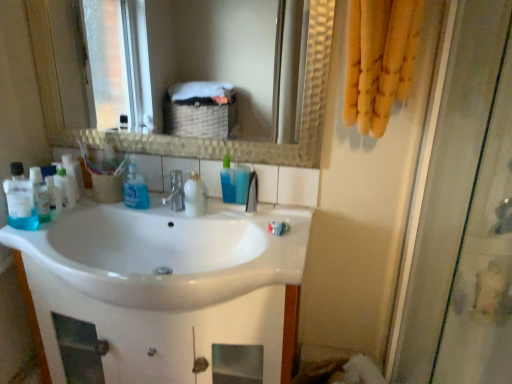
What is the approximate width of blue liquid soap at center, the 3th cleaning product from the right?

blue liquid soap at center, the 3th cleaning product from the right, is 3.65 inches wide.

You are a GUI agent. You are given a task and a screenshot of the screen. Output one action in this format:
    pyautogui.click(x=<x>, y=<y>)
    Task: Click on the transparent glass shower door at right
    
    Given the screenshot: What is the action you would take?
    pyautogui.click(x=466, y=216)

Identify the location of white glossy toothpaste at center. The height and width of the screenshot is (384, 512). (278, 228).

Find the location of a particular element. This screenshot has height=384, width=512. translucent plastic mouthwash at left, placed as the first mouthwash when sorted from front to back is located at coordinates (20, 200).

Identify the location of satin nickel faucet at center, the second tap positioned from the left. The image size is (512, 384). (252, 193).

Locate an element on the screen. This screenshot has width=512, height=384. blue liquid soap at center, acting as the 2th cleaning product starting from the left is located at coordinates (135, 190).

Which of these two, translucent plastic mouthwash at left, placed as the first mouthwash when sorted from front to back, or blue translucent bottle at center, arranged as the 1th cleaning product when viewed from the right, stands shorter?

blue translucent bottle at center, arranged as the 1th cleaning product when viewed from the right, is shorter.

Does point (15, 226) come closer to viewer compared to point (229, 180)?

Yes, point (15, 226) is in front of point (229, 180).

Starting from the translucent plastic mouthwash at left, placed as the first mouthwash when sorted from front to back, which cleaning product is the 4th one to the right? Please provide its 2D coordinates.

[(227, 181)]

How many degrees apart are the facing directions of translucent plastic mouthwash at left, which ranks as the 2th mouthwash in back-to-front order, and blue translucent bottle at center, arranged as the 1th cleaning product when viewed from the right?

The angle between the facing direction of translucent plastic mouthwash at left, which ranks as the 2th mouthwash in back-to-front order, and the facing direction of blue translucent bottle at center, arranged as the 1th cleaning product when viewed from the right, is 88.5 degrees.

Which object is wider, white glossy bottle at center, which is the 3th cleaning product in left-to-right order, or white glossy toothpaste at center?

Wider between the two is white glossy bottle at center, which is the 3th cleaning product in left-to-right order.

Would you consider white glossy bottle at center, which is the 3th cleaning product in left-to-right order, to be distant from white glossy toothpaste at center?

Actually, white glossy bottle at center, which is the 3th cleaning product in left-to-right order, and white glossy toothpaste at center are a little close together.

Is point (186, 182) farther from camera compared to point (280, 228)?

Yes, it is.

How many degrees apart are the facing directions of white glossy bottle at center, marked as the second cleaning product in a right-to-left arrangement, and white glossy toothpaste at center?

They differ by 2.46 degrees in their facing directions.

Is white glossy sink at center bigger than satin nickel faucet at center, placed as the 1th tap when sorted from right to left?

Indeed, white glossy sink at center has a larger size compared to satin nickel faucet at center, placed as the 1th tap when sorted from right to left.

Identify the location of sink lying on the left of satin nickel faucet at center, placed as the 1th tap when sorted from right to left. (168, 253).

Is white glossy sink at center at the right side of satin nickel faucet at center, the second tap positioned from the left?

No, white glossy sink at center is not to the right of satin nickel faucet at center, the second tap positioned from the left.

Could you measure the distance between white glossy sink at center and satin nickel faucet at center, the second tap positioned from the left?

They are 37.54 centimeters apart.

Considering the relative sizes of translucent plastic mouthwash at left, placed as the first mouthwash when sorted from front to back, and white glossy sink at center in the image provided, is translucent plastic mouthwash at left, placed as the first mouthwash when sorted from front to back, shorter than white glossy sink at center?

Correct, translucent plastic mouthwash at left, placed as the first mouthwash when sorted from front to back, is not as tall as white glossy sink at center.

Considering the positions of point (10, 222) and point (153, 306), is point (10, 222) closer or farther from the camera than point (153, 306)?

Point (10, 222).

Consider the image. Is translucent plastic mouthwash at left, the 2th mouthwash from the right, bigger than white glossy sink at center?

Incorrect, translucent plastic mouthwash at left, the 2th mouthwash from the right, is not larger than white glossy sink at center.

From the image's perspective, between translucent plastic mouthwash at left, the first mouthwash from the left, and white glossy sink at center, which one is located above?

From the image's view, translucent plastic mouthwash at left, the first mouthwash from the left, is above.

Where is `the 2nd tap to the left of the transparent glass shower door at right, starting your count from the anchor`? The image size is (512, 384). the 2nd tap to the left of the transparent glass shower door at right, starting your count from the anchor is located at coordinates (175, 192).

Which object is closer to the camera, transparent glass shower door at right or satin nickel faucet at center, which ranks as the first tap in left-to-right order?

transparent glass shower door at right is closer to the camera.

Considering the relative positions of transparent glass shower door at right and satin nickel faucet at center, which ranks as the first tap in left-to-right order, in the image provided, is transparent glass shower door at right to the left of satin nickel faucet at center, which ranks as the first tap in left-to-right order, from the viewer's perspective?

In fact, transparent glass shower door at right is to the right of satin nickel faucet at center, which ranks as the first tap in left-to-right order.

Is transparent glass shower door at right not close to satin nickel faucet at center, arranged as the 2th tap when viewed from the right?

Absolutely, transparent glass shower door at right is distant from satin nickel faucet at center, arranged as the 2th tap when viewed from the right.

Can you confirm if translucent plastic mouthwash at left, which ranks as the 2th mouthwash in back-to-front order, is wider than blue translucent bottle at center, the second mouthwash positioned from the front?

Indeed, translucent plastic mouthwash at left, which ranks as the 2th mouthwash in back-to-front order, has a greater width compared to blue translucent bottle at center, the second mouthwash positioned from the front.

Which object is closer to the camera taking this photo, translucent plastic mouthwash at left, the 2th mouthwash from the right, or blue translucent bottle at center, the 1th mouthwash when ordered from right to left?

translucent plastic mouthwash at left, the 2th mouthwash from the right, is in front.

From the image's perspective, does translucent plastic mouthwash at left, placed as the first mouthwash when sorted from front to back, appear higher than blue translucent bottle at center, which ranks as the first mouthwash in back-to-front order?

Actually, translucent plastic mouthwash at left, placed as the first mouthwash when sorted from front to back, appears below blue translucent bottle at center, which ranks as the first mouthwash in back-to-front order, in the image.

Is translucent plastic mouthwash at left, the first mouthwash from the left, to the left or to the right of blue translucent bottle at center, the second mouthwash positioned from the front, in the image?

In the image, translucent plastic mouthwash at left, the first mouthwash from the left, appears on the left side of blue translucent bottle at center, the second mouthwash positioned from the front.

The image size is (512, 384). I want to click on the 1st cleaning product below when counting from the blue liquid soap at center, acting as the 2th cleaning product starting from the left (from the image's perspective), so click(x=65, y=186).

Which of these two, translucent plastic bottles at left, which is the first cleaning product in left-to-right order, or blue liquid soap at center, acting as the 2th cleaning product starting from the left, stands shorter?

Standing shorter between the two is translucent plastic bottles at left, which is the first cleaning product in left-to-right order.

Is point (73, 186) more distant than point (125, 201)?

No, it is not.

From the image's perspective, is translucent plastic bottles at left, which ranks as the fourth cleaning product in right-to-left order, located above or below blue liquid soap at center, the 3th cleaning product from the right?

translucent plastic bottles at left, which ranks as the fourth cleaning product in right-to-left order, is below blue liquid soap at center, the 3th cleaning product from the right.

Where is `the 4th cleaning product positioned above the translucent plastic mouthwash at left, the first mouthwash from the left (from the image's perspective)`? Image resolution: width=512 pixels, height=384 pixels. the 4th cleaning product positioned above the translucent plastic mouthwash at left, the first mouthwash from the left (from the image's perspective) is located at coordinates (227, 181).

Identify the location of the 2nd cleaning product to the left of the white glossy toothpaste at center, counting from the anchor's position. [x=195, y=196].

Considering their positions, is white glossy toothpaste at center positioned further to transparent glass shower door at right than translucent plastic bottles at left, which is the first cleaning product in left-to-right order?

translucent plastic bottles at left, which is the first cleaning product in left-to-right order, lies further to transparent glass shower door at right than the other object.

Based on their spatial positions, is blue translucent bottle at center, which ranks as the first mouthwash in back-to-front order, or satin nickel faucet at center, placed as the 1th tap when sorted from right to left, closer to white glossy bottle at center, which is the 3th cleaning product in left-to-right order?

blue translucent bottle at center, which ranks as the first mouthwash in back-to-front order.

When comparing their distances from blue translucent bottle at center, arranged as the 1th cleaning product when viewed from the right, does translucent plastic bottles at left, which ranks as the fourth cleaning product in right-to-left order, or blue liquid soap at center, the 3th cleaning product from the right, seem closer?

Among the two, blue liquid soap at center, the 3th cleaning product from the right, is located nearer to blue translucent bottle at center, arranged as the 1th cleaning product when viewed from the right.

Based on their spatial positions, is translucent plastic mouthwash at left, which ranks as the 2th mouthwash in back-to-front order, or white glossy toothpaste at center closer to satin nickel faucet at center, placed as the 1th tap when sorted from right to left?

Based on the image, white glossy toothpaste at center appears to be nearer to satin nickel faucet at center, placed as the 1th tap when sorted from right to left.

In the scene shown: Based on their spatial positions, is white glossy sink at center or translucent plastic mouthwash at left, the first mouthwash from the left, closer to blue translucent bottle at center, which ranks as the first mouthwash in back-to-front order?

white glossy sink at center is closer to blue translucent bottle at center, which ranks as the first mouthwash in back-to-front order.

Which object lies further to the anchor point blue liquid soap at center, acting as the 2th cleaning product starting from the left, white glossy bottle at center, marked as the second cleaning product in a right-to-left arrangement, or blue translucent bottle at center, arranged as the 1th cleaning product when viewed from the right?

Among the two, blue translucent bottle at center, arranged as the 1th cleaning product when viewed from the right, is located further to blue liquid soap at center, acting as the 2th cleaning product starting from the left.

Looking at the image, which one is located closer to satin nickel faucet at center, the second tap positioned from the left, translucent plastic mouthwash at left, which ranks as the 2th mouthwash in back-to-front order, or translucent plastic bottles at left, which ranks as the fourth cleaning product in right-to-left order?

Among the two, translucent plastic bottles at left, which ranks as the fourth cleaning product in right-to-left order, is located nearer to satin nickel faucet at center, the second tap positioned from the left.

Estimate the real-world distances between objects in this image. Which object is further from blue liquid soap at center, the 3th cleaning product from the right, satin nickel faucet at center, placed as the 1th tap when sorted from right to left, or blue translucent bottle at center, which appears as the fourth cleaning product when viewed from the left?

satin nickel faucet at center, placed as the 1th tap when sorted from right to left.

In order to click on sink between transparent glass shower door at right and blue translucent bottle at center, arranged as the 1th cleaning product when viewed from the right, along the z-axis in this screenshot , I will do `click(168, 253)`.

Identify the location of tap between transparent glass shower door at right and satin nickel faucet at center, the second tap positioned from the left, from front to back. (175, 192).

Locate an element on the screen. Image resolution: width=512 pixels, height=384 pixels. toothpaste between translucent plastic mouthwash at left, the 2th mouthwash from the right, and transparent glass shower door at right from left to right is located at coordinates (278, 228).

Where is `cleaning product between translucent plastic bottles at left, which is the first cleaning product in left-to-right order, and satin nickel faucet at center, arranged as the 2th tap when viewed from the right, in the horizontal direction`? The image size is (512, 384). cleaning product between translucent plastic bottles at left, which is the first cleaning product in left-to-right order, and satin nickel faucet at center, arranged as the 2th tap when viewed from the right, in the horizontal direction is located at coordinates (135, 190).